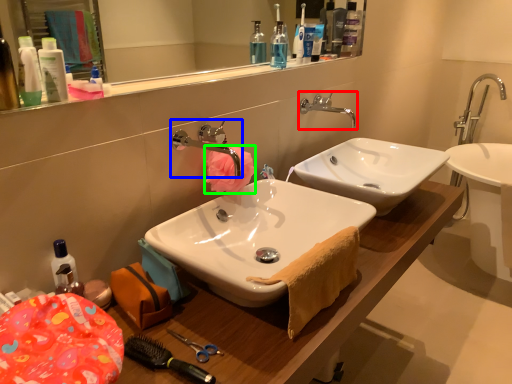
Question: Considering the real-world distances, which object is farthest from tap (highlighted by a red box)? tap (highlighted by a blue box) or flower (highlighted by a green box)?

Choices:
 (A) tap
 (B) flower

Answer: (A)